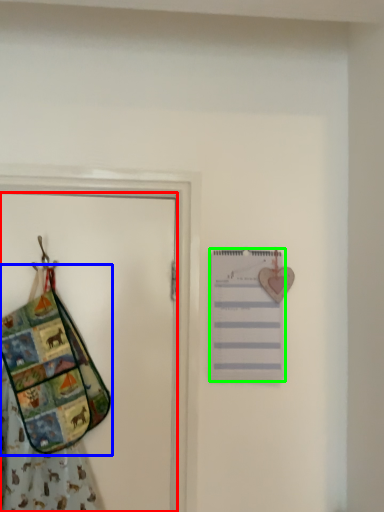
Question: Estimate the real-world distances between objects in this image. Which object is closer to door (highlighted by a red box), handbag (highlighted by a blue box) or list (highlighted by a green box)?

Choices:
 (A) handbag
 (B) list

Answer: (A)